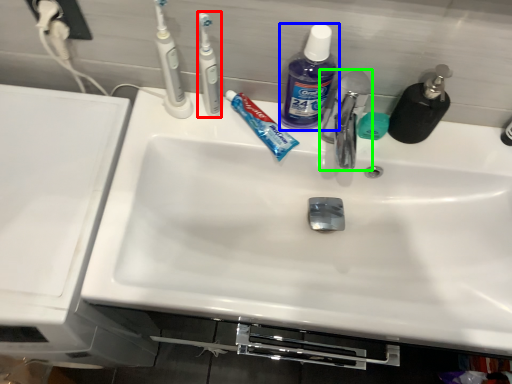
Question: Which object is the farthest from toothbrush (highlighted by a red box)? Choose among these: cleaning product (highlighted by a blue box) or tap (highlighted by a green box).

Choices:
 (A) cleaning product
 (B) tap

Answer: (B)